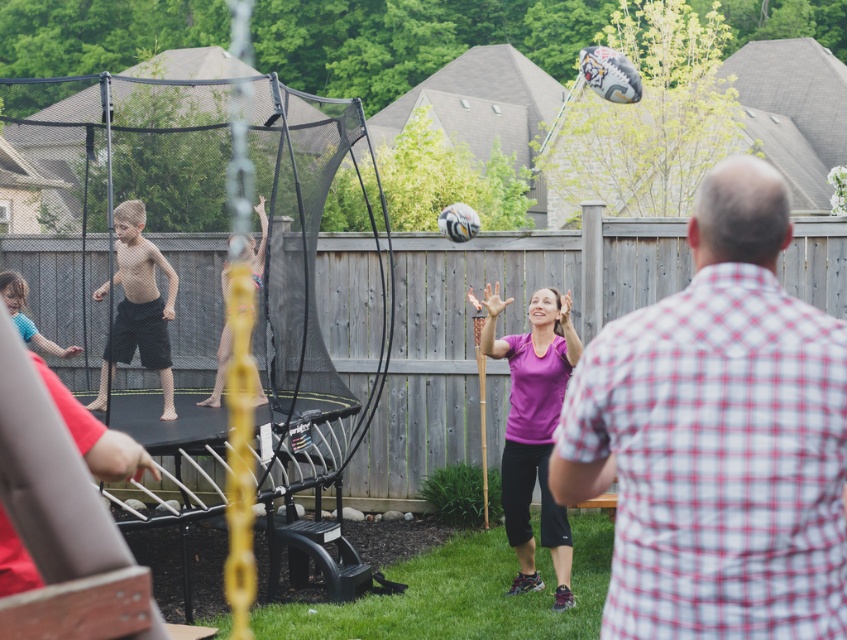
You are a photographer standing in the backyard and want to capture a photo of the purple matte shirt at center and the pink fabric shorts at center. Which one is positioned lower in the image?

The purple matte shirt at center is below the pink fabric shorts at center, so it is positioned lower in the image.

You are a photographer trying to capture a candid shot of the purple matte shirt at center and the black matte shorts at center. To ensure both subjects are in frame, should you adjust your camera to focus more to the left or the right?

The purple matte shirt at center is to the right of the black matte shorts at center, so you should focus more to the right to include both subjects in the frame.

Consider the image. You are standing in the backyard and want to place a small garden gnome between the two points, point (523,582) and point (214,378). Which point should the gnome be closer to if you want it to be nearer to the trampoline?

The gnome should be placed closer to point (523,582) because it is closer to the viewer, which would place it nearer to the trampoline located in the foreground.